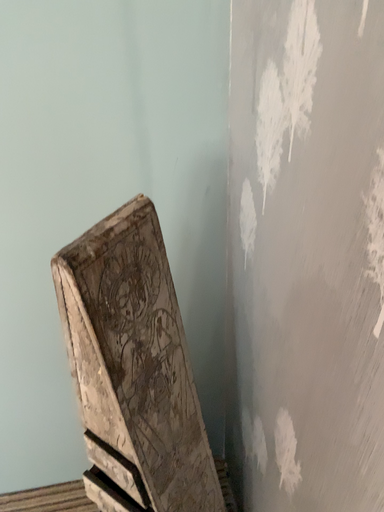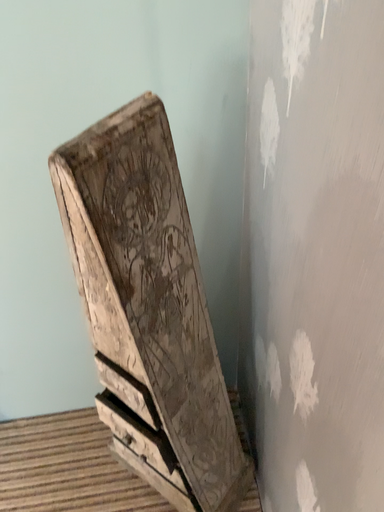
Question: How did the camera likely rotate when shooting the video?

Choices:
 (A) rotated downward
 (B) rotated upward

Answer: (A)